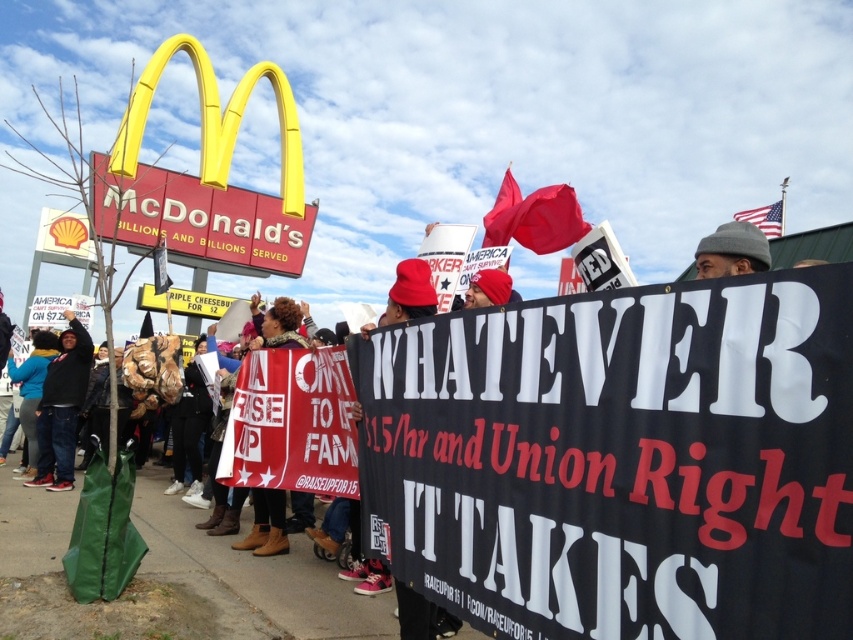
Question: Which object appears farthest from the camera in this image?

Choices:
 (A) black fabric banner at center
 (B) dark blue jeans at lower left

Answer: (B)

Question: Among these objects, which one is nearest to the camera?

Choices:
 (A) gray knit cap at upper right
 (B) american flag at upper right

Answer: (A)

Question: Which point is farther from the camera taking this photo?

Choices:
 (A) (169, 212)
 (B) (485, 221)

Answer: (A)

Question: Does matte red flag at upper center appear over american flag at upper right?

Choices:
 (A) no
 (B) yes

Answer: (A)

Question: Can you confirm if black fabric banner at center is positioned above american flag at upper right?

Choices:
 (A) no
 (B) yes

Answer: (A)

Question: Does matte red flag at upper center have a lesser width compared to american flag at upper right?

Choices:
 (A) yes
 (B) no

Answer: (A)